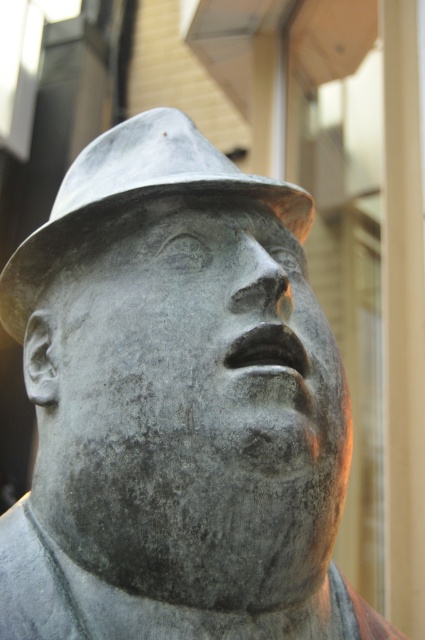
Is point (295, 384) closer to viewer compared to point (45, 228)?

Yes, it is.

You are a GUI agent. You are given a task and a screenshot of the screen. Output one action in this format:
    pyautogui.click(x=<x>, y=<y>)
    Task: Click on the gray stone face at center
    The width and height of the screenshot is (425, 640).
    Given the screenshot: What is the action you would take?
    pyautogui.click(x=198, y=355)